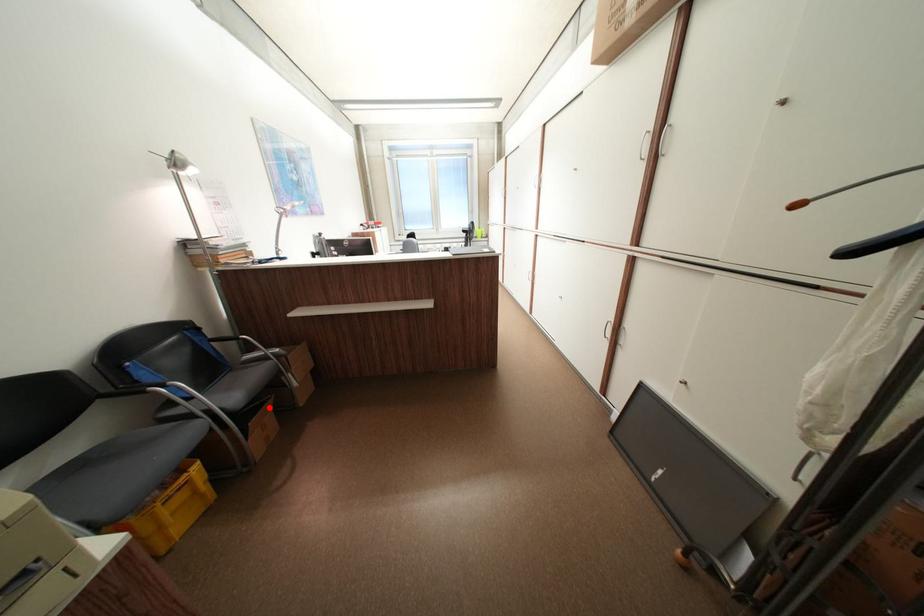
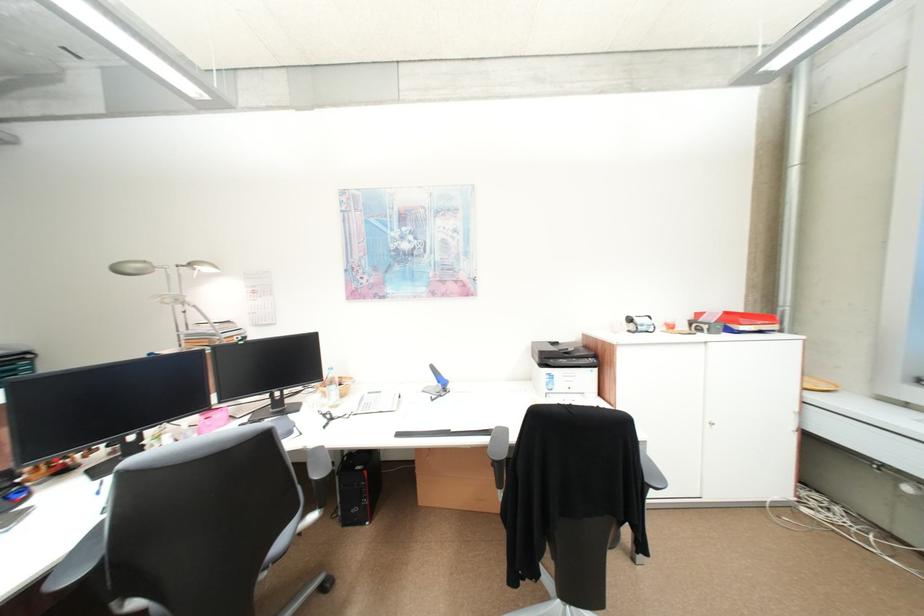
Question: I am providing you with two images of the same scene from different viewpoints. A red point is marked on the first image. At the location where the point appears in image 1, is it still visible in image 2?

Choices:
 (A) Yes
 (B) No

Answer: (B)